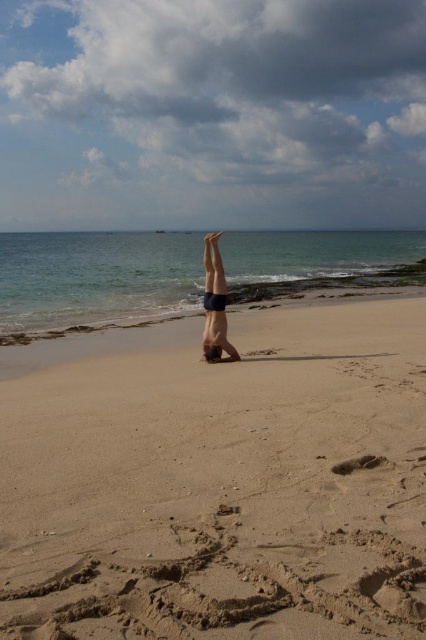
You are a photographer standing at the edge of the beach. You want to take a photo of the smooth skin person at center without the sandy tan at center appearing in the foreground. Is this possible?

The sandy tan at center is in front of the smooth skin person at center, so it will block the view. You cannot take a photo of the smooth skin person at center without the sandy tan at center appearing in the foreground.

Based on the photo, you are a photographer trying to capture the smooth skin person at center and the sandy tan at center in a single frame. Based on their widths, which one will occupy more space horizontally in the photo?

The sandy tan at center has a greater width than the smooth skin person at center, so it will occupy more horizontal space in the photo.